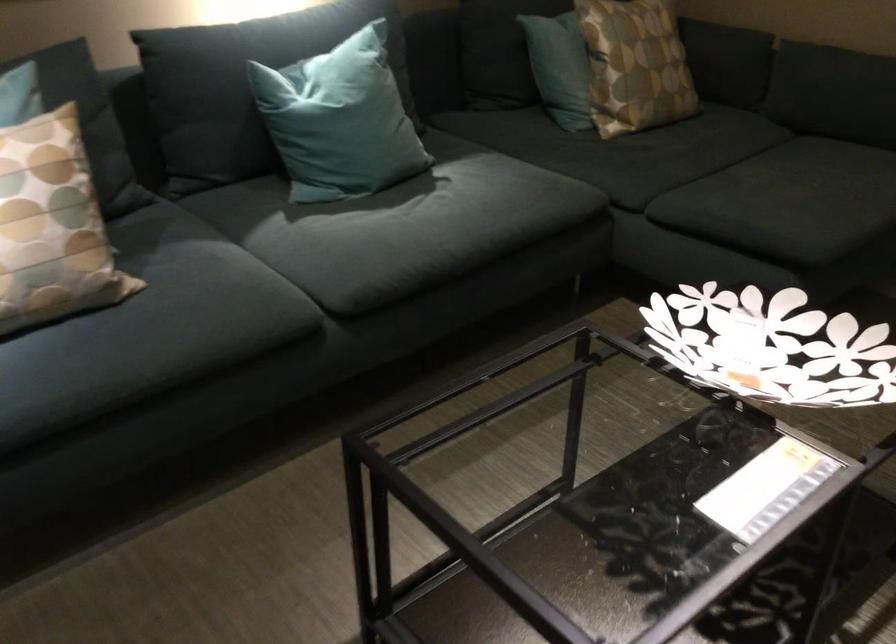
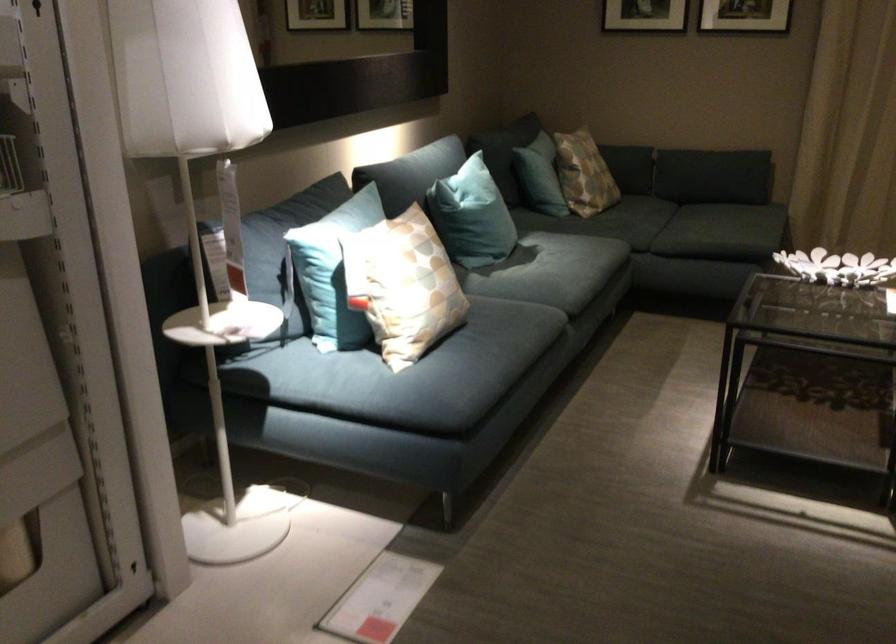
The point at (582, 80) is marked in the first image. Where is the corresponding point in the second image?

(583, 174)